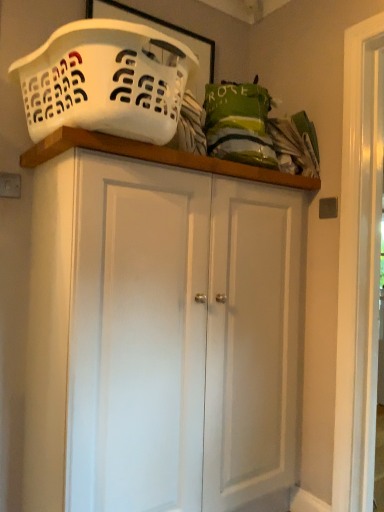
Question: Can we say white matte cupboard at center lies outside white plastic laundry basket at upper left?

Choices:
 (A) yes
 (B) no

Answer: (A)

Question: Can you confirm if white matte cupboard at center is thinner than white plastic laundry basket at upper left?

Choices:
 (A) yes
 (B) no

Answer: (A)

Question: Are white matte cupboard at center and white plastic laundry basket at upper left making contact?

Choices:
 (A) no
 (B) yes

Answer: (A)

Question: Is white matte cupboard at center turned away from white plastic laundry basket at upper left?

Choices:
 (A) no
 (B) yes

Answer: (A)

Question: Is white matte cupboard at center at the right side of white plastic laundry basket at upper left?

Choices:
 (A) no
 (B) yes

Answer: (B)

Question: Is white matte cupboard at center wider than white plastic laundry basket at upper left?

Choices:
 (A) no
 (B) yes

Answer: (A)

Question: From a real-world perspective, does white plastic laundry basket at upper left sit lower than white matte cupboard at center?

Choices:
 (A) no
 (B) yes

Answer: (A)

Question: Is the depth of white plastic laundry basket at upper left greater than that of white matte cupboard at center?

Choices:
 (A) yes
 (B) no

Answer: (B)

Question: Is white plastic laundry basket at upper left placed right next to white matte cupboard at center?

Choices:
 (A) no
 (B) yes

Answer: (A)

Question: Is white plastic laundry basket at upper left shorter than white matte cupboard at center?

Choices:
 (A) yes
 (B) no

Answer: (A)

Question: Is white plastic laundry basket at upper left looking in the opposite direction of white matte cupboard at center?

Choices:
 (A) no
 (B) yes

Answer: (A)

Question: From the image's perspective, is white plastic laundry basket at upper left on top of white matte cupboard at center?

Choices:
 (A) no
 (B) yes

Answer: (B)

Question: From the image's perspective, is white matte cupboard at center located above or below white plastic laundry basket at upper left?

Choices:
 (A) above
 (B) below

Answer: (B)